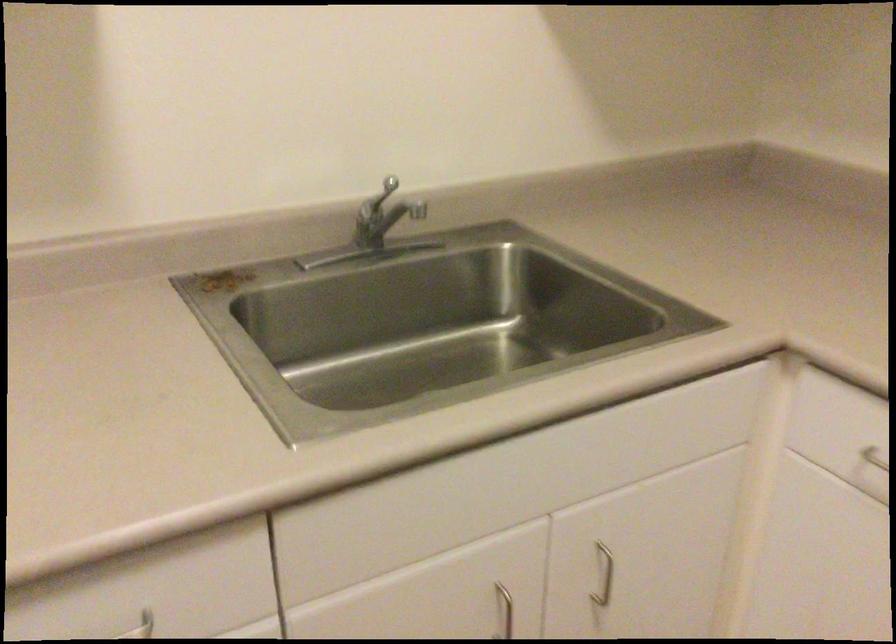
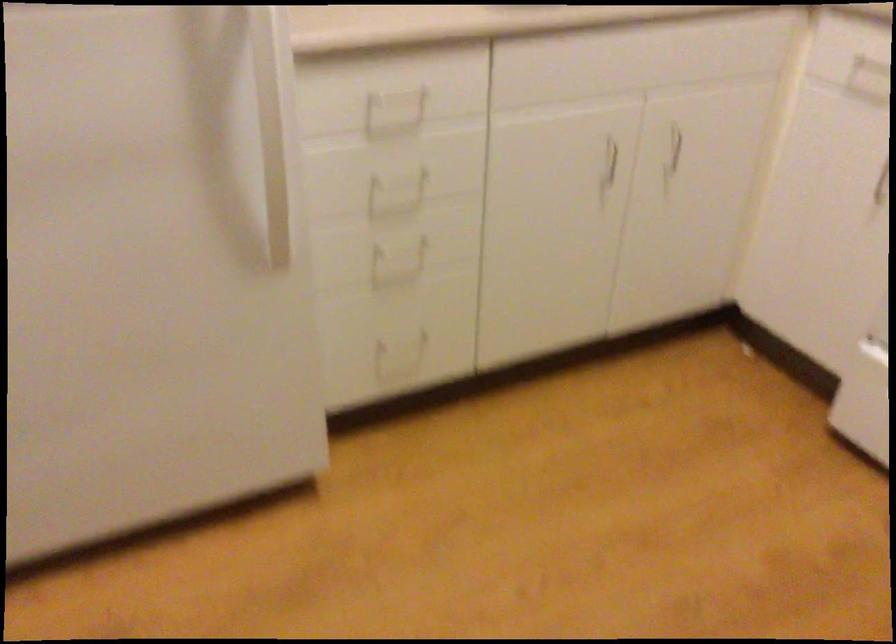
Where in the second image is the point corresponding to (x=607, y=571) from the first image?

(675, 147)